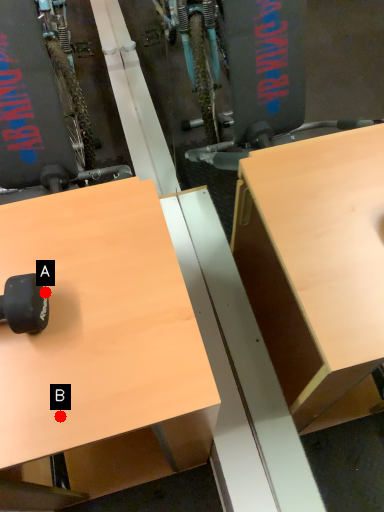
Question: Two points are circled on the image, labeled by A and B beside each circle. Which point is closer to the camera taking this photo?

Choices:
 (A) A is closer
 (B) B is closer

Answer: (B)